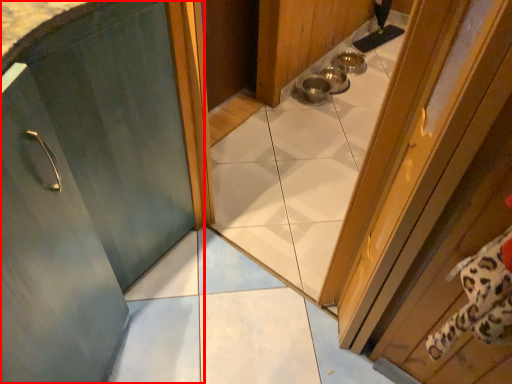
Question: From the image's perspective, where is door (annotated by the red box) located in relation to door in the image?

Choices:
 (A) below
 (B) above

Answer: (B)